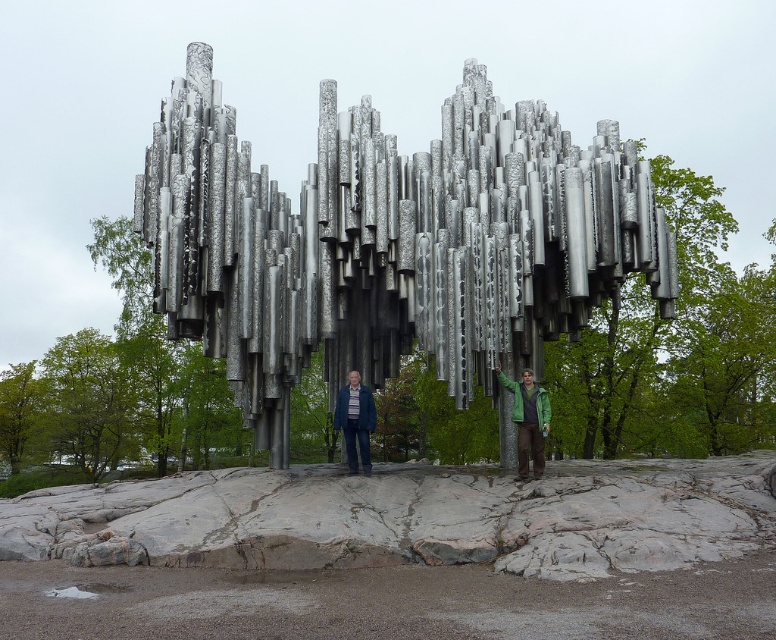
Question: Estimate the real-world distances between objects in this image. Which object is closer to the green matte jacket at center?

Choices:
 (A) matte blue jacket at center
 (B) metallic textured jackets at center
 (C) silver metallic wind chimes at center

Answer: (A)

Question: Observing the image, what is the correct spatial positioning of silver metallic wind chimes at center in reference to matte blue jacket at center?

Choices:
 (A) above
 (B) below

Answer: (A)

Question: Can you confirm if green matte jacket at center is thinner than matte blue jacket at center?

Choices:
 (A) yes
 (B) no

Answer: (A)

Question: Can you confirm if metallic textured jackets at center is smaller than green matte jacket at center?

Choices:
 (A) yes
 (B) no

Answer: (B)

Question: Which point is closer to the camera?

Choices:
 (A) (522, 432)
 (B) (501, 284)

Answer: (A)

Question: Based on their relative distances, which object is nearer to the silver metallic wind chimes at center?

Choices:
 (A) green matte jacket at center
 (B) matte blue jacket at center
 (C) metallic textured jackets at center

Answer: (B)